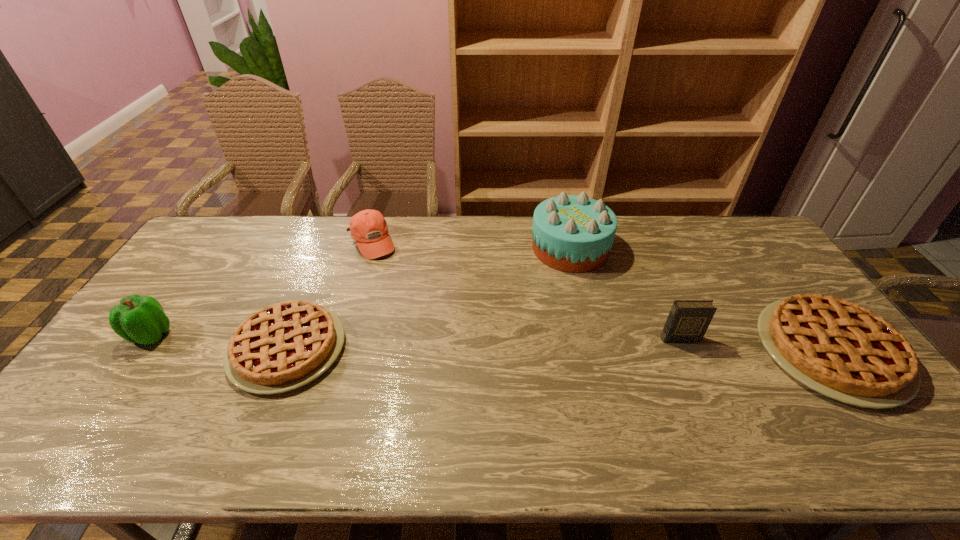
You are a GUI agent. You are given a task and a screenshot of the screen. Output one action in this format:
    pyautogui.click(x=<x>, y=<y>)
    Task: Click on the shorter pie
    Image resolution: width=960 pixels, height=540 pixels.
    Given the screenshot: What is the action you would take?
    284,346

Identify the location of the left pie. The width and height of the screenshot is (960, 540). (284, 346).

This screenshot has height=540, width=960. I want to click on the taller pie, so click(x=839, y=349).

Where is `the right pie`? The height and width of the screenshot is (540, 960). the right pie is located at coordinates (839, 349).

Locate an element on the screen. The height and width of the screenshot is (540, 960). the tallest object is located at coordinates (571, 233).

The width and height of the screenshot is (960, 540). In order to click on the fourth object from left to right in this screenshot , I will do `click(571, 233)`.

Locate an element on the screen. baseball cap is located at coordinates (369, 229).

Where is `bell pepper`? The width and height of the screenshot is (960, 540). bell pepper is located at coordinates (139, 319).

This screenshot has width=960, height=540. Find the location of `diary`. diary is located at coordinates (688, 320).

Where is `free space located on the left of the shorter pie`? The width and height of the screenshot is (960, 540). free space located on the left of the shorter pie is located at coordinates (165, 348).